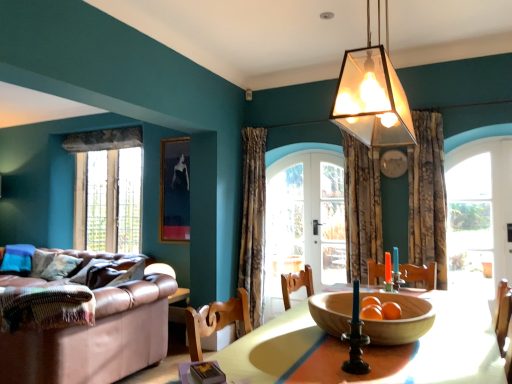
Question: Are wooden table at center and translucent glass pendant light at upper center beside each other?

Choices:
 (A) no
 (B) yes

Answer: (A)

Question: Can translucent glass pendant light at upper center be found inside wooden table at center?

Choices:
 (A) yes
 (B) no

Answer: (B)

Question: Is wooden table at center wider than translucent glass pendant light at upper center?

Choices:
 (A) no
 (B) yes

Answer: (B)

Question: Considering the relative positions of wooden table at center and translucent glass pendant light at upper center in the image provided, is wooden table at center to the left of translucent glass pendant light at upper center from the viewer's perspective?

Choices:
 (A) no
 (B) yes

Answer: (A)

Question: Is wooden table at center far from translucent glass pendant light at upper center?

Choices:
 (A) no
 (B) yes

Answer: (A)

Question: Can you confirm if wooden table at center is shorter than translucent glass pendant light at upper center?

Choices:
 (A) no
 (B) yes

Answer: (B)

Question: From a real-world perspective, is wooden table at center on top of clear glass window at right, acting as the second window starting from the back?

Choices:
 (A) yes
 (B) no

Answer: (B)

Question: Is wooden table at center not close to clear glass window at right, arranged as the first window when viewed from the right?

Choices:
 (A) no
 (B) yes

Answer: (B)

Question: From the image's perspective, is wooden table at center below clear glass window at right, which is counted as the second window, starting from the left?

Choices:
 (A) no
 (B) yes

Answer: (B)

Question: Is wooden table at center facing towards clear glass window at right, marked as the 1th window in a front-to-back arrangement?

Choices:
 (A) no
 (B) yes

Answer: (A)

Question: Is wooden table at center at the left side of clear glass window at right, acting as the second window starting from the back?

Choices:
 (A) yes
 (B) no

Answer: (A)

Question: Considering the relative sizes of wooden table at center and clear glass window at right, acting as the second window starting from the back, in the image provided, is wooden table at center shorter than clear glass window at right, acting as the second window starting from the back,?

Choices:
 (A) yes
 (B) no

Answer: (A)

Question: Is clear glass window at left, the 1th window from the back, facing away from textured floral fabric curtain at center, which appears as the third curtain when viewed from the left?

Choices:
 (A) no
 (B) yes

Answer: (A)